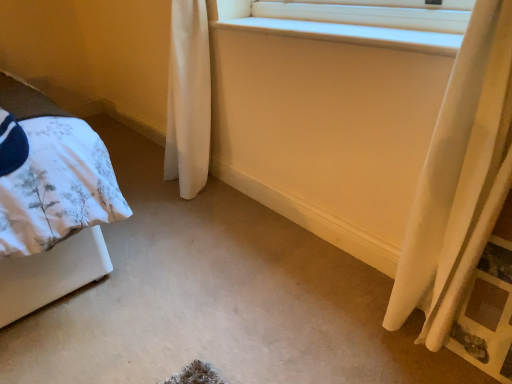
What do you see at coordinates (350, 34) in the screenshot? I see `white smooth window sill at upper center` at bounding box center [350, 34].

Locate an element on the screen. white smooth window sill at upper center is located at coordinates (350, 34).

Where is `white smooth window sill at upper center`? The image size is (512, 384). white smooth window sill at upper center is located at coordinates (350, 34).